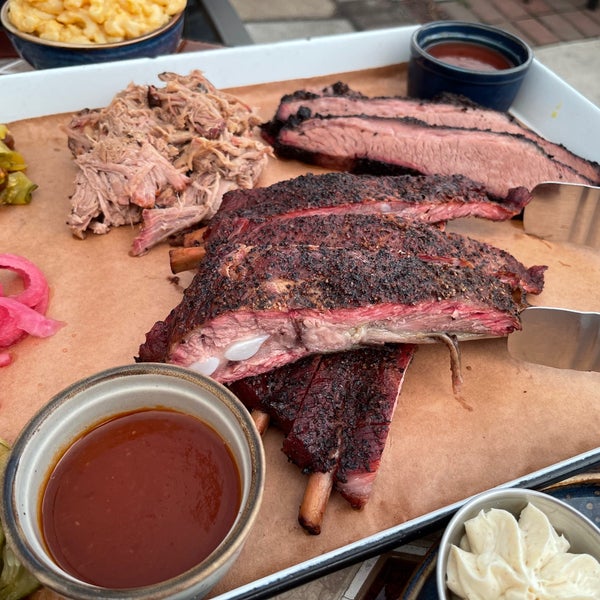
You are a GUI agent. You are given a task and a screenshot of the screen. Output one action in this format:
    pyautogui.click(x=<x>, y=<y>)
    Task: Click on the bowl
    Image resolution: width=600 pixels, height=600 pixels.
    Given the screenshot: What is the action you would take?
    pyautogui.click(x=219, y=418), pyautogui.click(x=464, y=75), pyautogui.click(x=131, y=39), pyautogui.click(x=502, y=505)